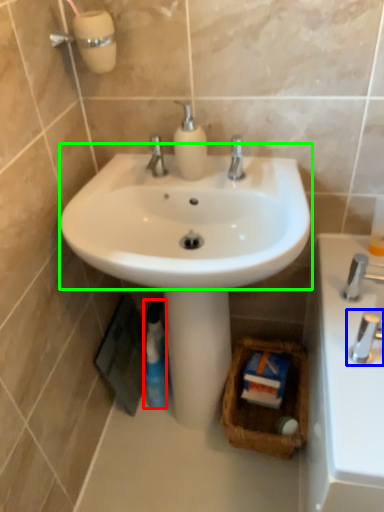
Question: Estimate the real-world distances between objects in this image. Which object is closer to mouthwash (highlighted by a red box), tap (highlighted by a blue box) or sink (highlighted by a green box)?

Choices:
 (A) tap
 (B) sink

Answer: (B)